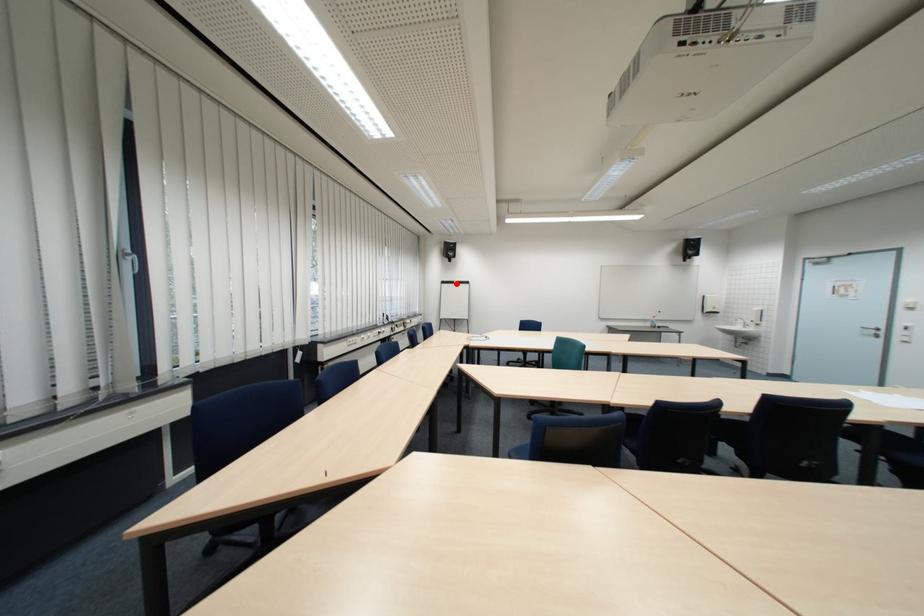
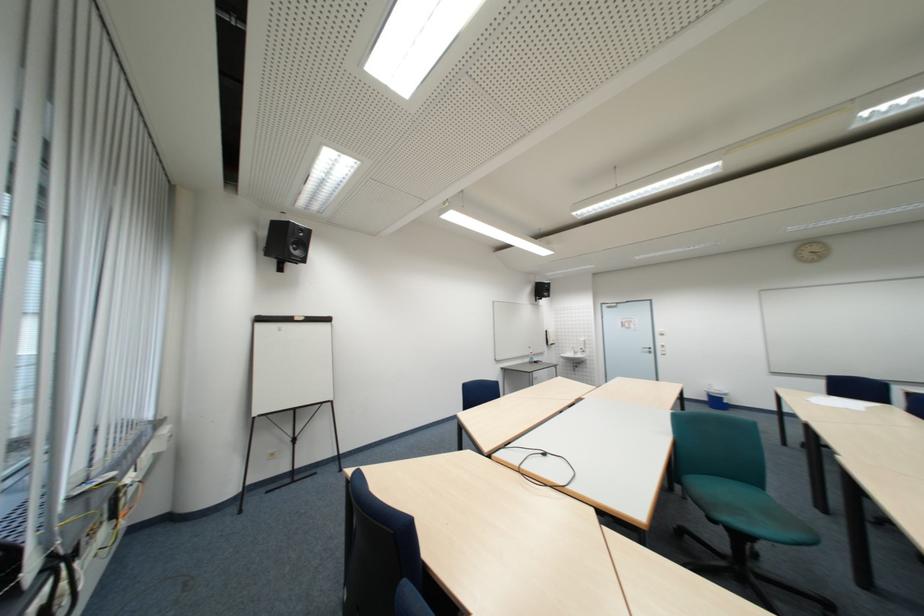
Question: I am providing you with two images of the same scene from different viewpoints. A red point is marked on the first image. Can you still see the location of the red point in image 2?

Choices:
 (A) Yes
 (B) No

Answer: (A)